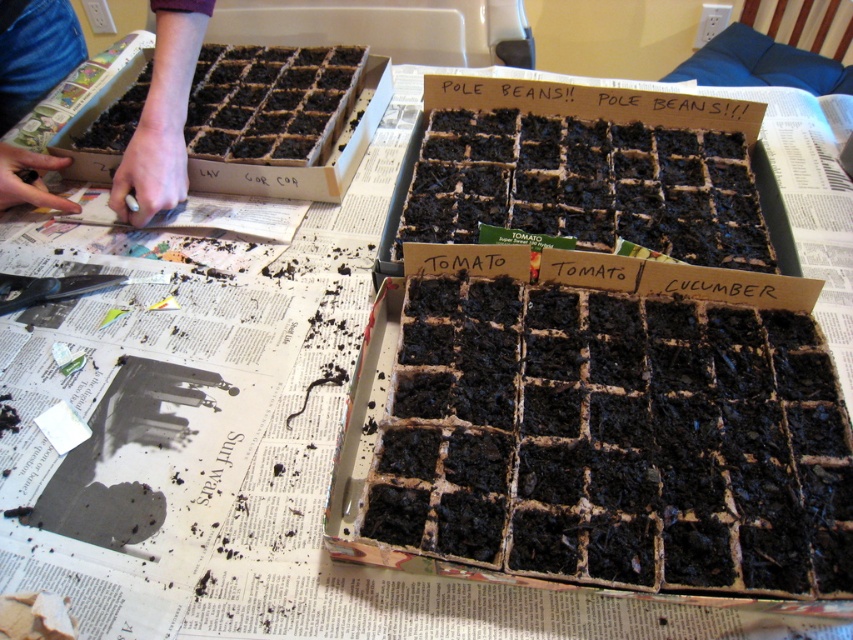
Question: Can you confirm if smooth skin hand at upper left is thinner than brown cardboard box at upper left?

Choices:
 (A) no
 (B) yes

Answer: (B)

Question: Is the position of smooth skin hand at upper left more distant than that of brown cardboard box at upper left?

Choices:
 (A) yes
 (B) no

Answer: (B)

Question: Among these objects, which one is farthest from the camera?

Choices:
 (A) smooth skin hand at upper left
 (B) brown cardboard box at upper left

Answer: (B)

Question: Among these objects, which one is nearest to the camera?

Choices:
 (A) brown cardboard box at upper left
 (B) smooth skin hand at upper left

Answer: (B)

Question: Is smooth skin hand at upper left to the left of brown cardboard box at upper left from the viewer's perspective?

Choices:
 (A) no
 (B) yes

Answer: (B)